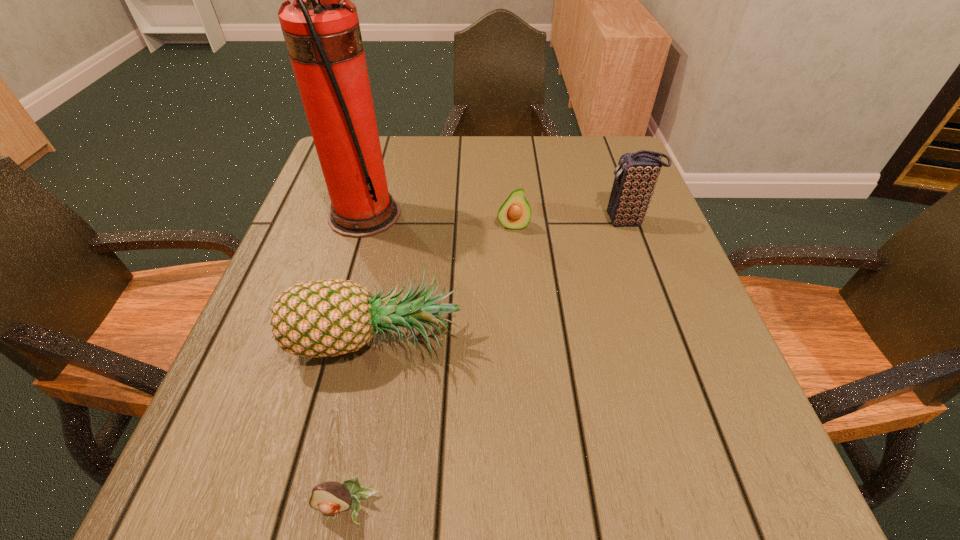
Where is `fire extinguisher`? fire extinguisher is located at coordinates (321, 29).

The width and height of the screenshot is (960, 540). Find the location of `clutch bag`. clutch bag is located at coordinates (636, 175).

Locate an element on the screen. the third shortest object is located at coordinates (325, 318).

Identify the location of pineapple. (325, 318).

You are a GUI agent. You are given a task and a screenshot of the screen. Output one action in this format:
    pyautogui.click(x=<x>, y=<y>)
    Task: Click on the farther avocado
    The image size is (960, 540).
    Given the screenshot: What is the action you would take?
    pyautogui.click(x=515, y=213)

The width and height of the screenshot is (960, 540). I want to click on the right avocado, so click(x=515, y=213).

The height and width of the screenshot is (540, 960). Identify the location of the shorter avocado. click(x=330, y=497).

Image resolution: width=960 pixels, height=540 pixels. I want to click on the shortest object, so click(x=330, y=497).

Locate an element on the screen. The width and height of the screenshot is (960, 540). vacant space situated at the discharge end of the fire extinguisher is located at coordinates (555, 215).

Identify the location of vacant space situated 0.120m with the zip open on the rightmost object. This screenshot has width=960, height=540. (549, 221).